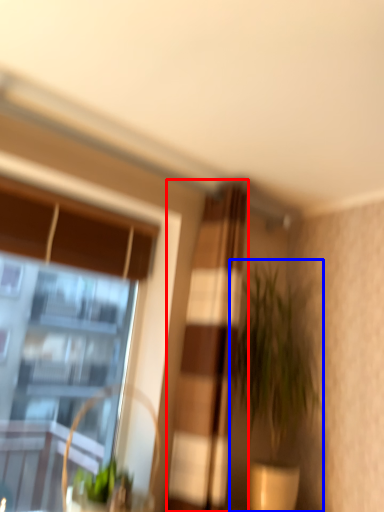
Question: Which of the following is the farthest to the observer, curtain (highlighted by a red box) or houseplant (highlighted by a blue box)?

Choices:
 (A) curtain
 (B) houseplant

Answer: (B)